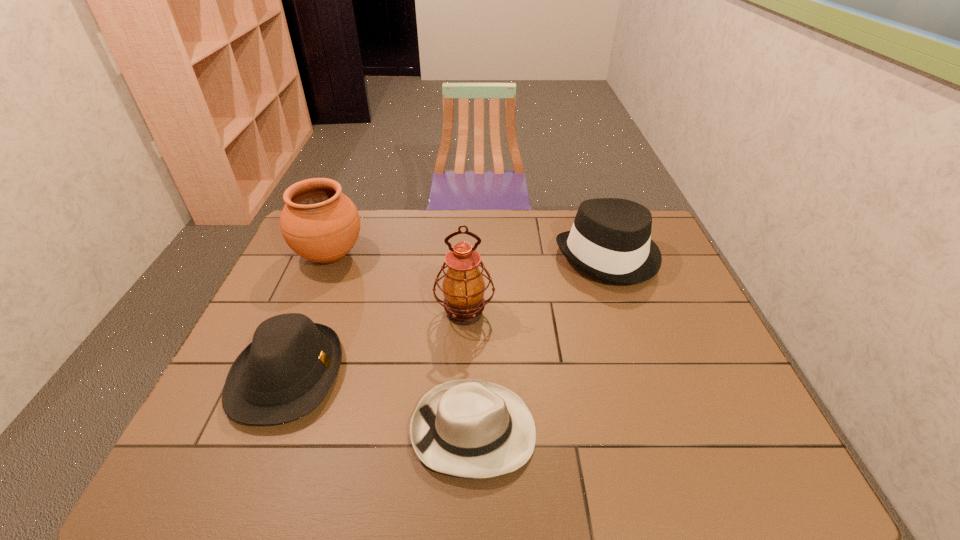
Find the location of `object that is at the far right corner`. object that is at the far right corner is located at coordinates (610, 239).

In the image, there is a desktop. What are the coordinates of `vacant space at the far edge` in the screenshot? It's located at (487, 248).

In the image, there is a desktop. Where is `vacant region at the near edge`? The height and width of the screenshot is (540, 960). vacant region at the near edge is located at coordinates (260, 465).

Image resolution: width=960 pixels, height=540 pixels. In the image, there is a desktop. Identify the location of vacant space at the right edge. (719, 354).

In the image, there is a desktop. What are the coordinates of `vacant region at the near right corner` in the screenshot? It's located at (737, 464).

Identify the location of blank region between the oil lamp and the third tallest object. (537, 285).

Locate an element on the screen. free spot between the oil lamp and the second fedora from left to right is located at coordinates (469, 372).

I want to click on vacant space in between the second shortest fedora and the pottery, so coord(309,315).

Image resolution: width=960 pixels, height=540 pixels. Identify the location of vacant space that's between the tallest object and the leftmost fedora. (376, 344).

Where is `empty space that is in between the second shortest fedora and the oil lamp`? Image resolution: width=960 pixels, height=540 pixels. empty space that is in between the second shortest fedora and the oil lamp is located at coordinates (376, 344).